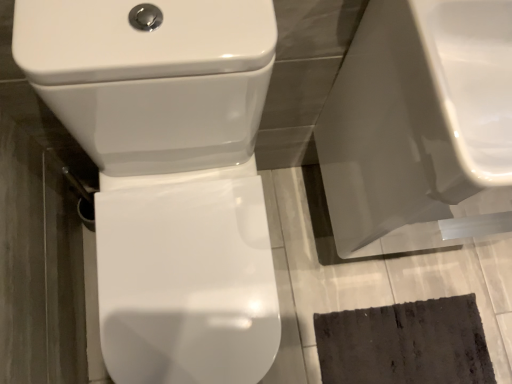
In order to click on spots to the right of white glossy toilet at center in this screenshot , I will do `click(335, 298)`.